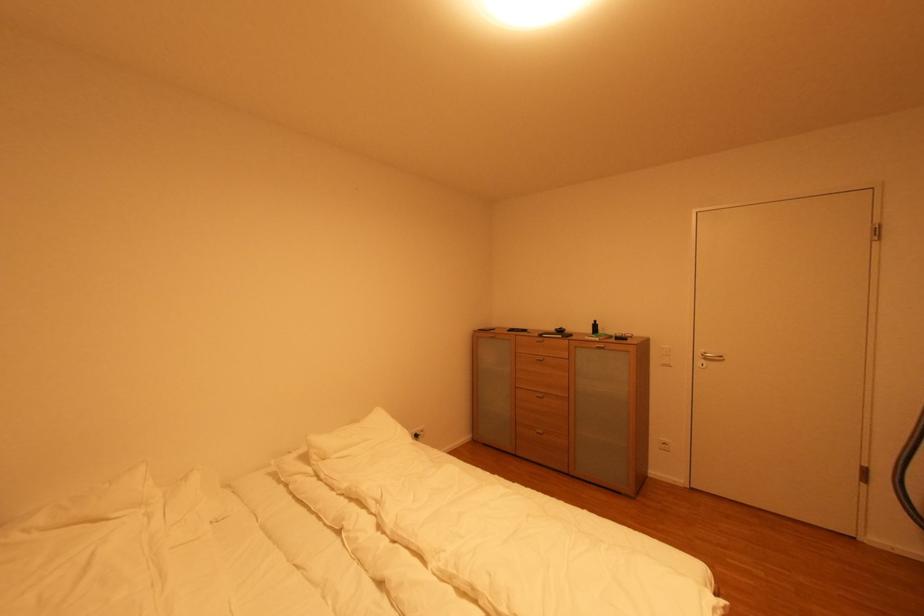
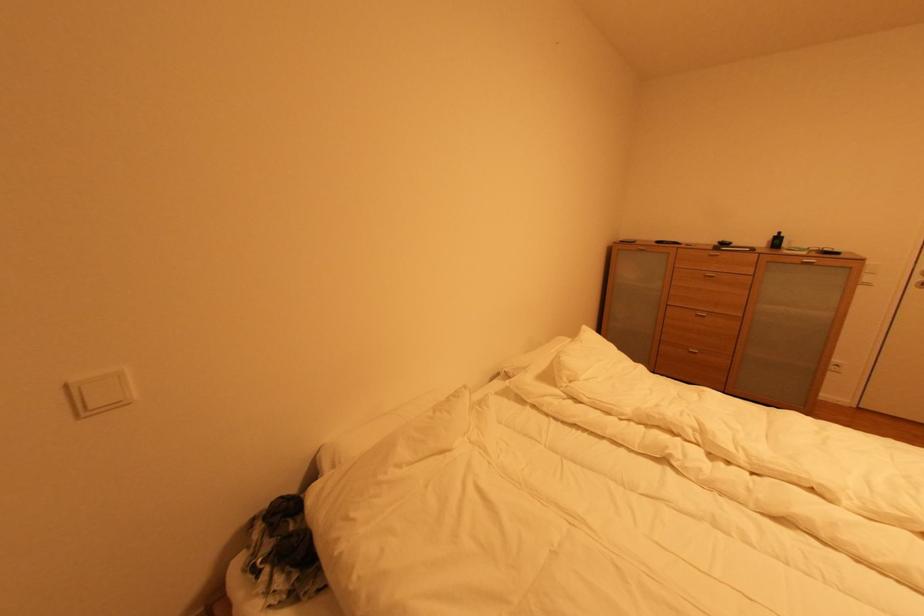
Question: The images are taken continuously from a first-person perspective. In which direction are you moving?

Choices:
 (A) Left
 (B) Right
 (C) Forward
 (D) Backward

Answer: (A)